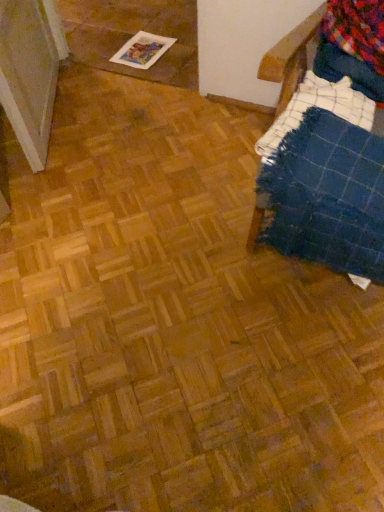
Question: Does multicolored flannel at upper right come in front of blue plaid blanket at right?

Choices:
 (A) no
 (B) yes

Answer: (A)

Question: Is multicolored flannel at upper right aimed at blue plaid blanket at right?

Choices:
 (A) no
 (B) yes

Answer: (B)

Question: Is multicolored flannel at upper right completely or partially outside of blue plaid blanket at right?

Choices:
 (A) no
 (B) yes

Answer: (A)

Question: From a real-world perspective, is multicolored flannel at upper right under blue plaid blanket at right?

Choices:
 (A) yes
 (B) no

Answer: (B)

Question: Is multicolored flannel at upper right oriented away from blue plaid blanket at right?

Choices:
 (A) yes
 (B) no

Answer: (A)

Question: In terms of height, does multicolored flannel at upper right look taller or shorter compared to printed paper magazine at upper left?

Choices:
 (A) short
 (B) tall

Answer: (B)

Question: In the image, is multicolored flannel at upper right positioned in front of or behind printed paper magazine at upper left?

Choices:
 (A) front
 (B) behind

Answer: (A)

Question: Is multicolored flannel at upper right to the left or to the right of printed paper magazine at upper left in the image?

Choices:
 (A) right
 (B) left

Answer: (A)

Question: Do you think multicolored flannel at upper right is within printed paper magazine at upper left, or outside of it?

Choices:
 (A) inside
 (B) outside

Answer: (B)

Question: From a real-world perspective, is printed paper magazine at upper left positioned above or below multicolored flannel at upper right?

Choices:
 (A) below
 (B) above

Answer: (A)

Question: Is printed paper magazine at upper left inside the boundaries of multicolored flannel at upper right, or outside?

Choices:
 (A) inside
 (B) outside

Answer: (B)

Question: From the image's perspective, is printed paper magazine at upper left above or below multicolored flannel at upper right?

Choices:
 (A) above
 (B) below

Answer: (A)

Question: Considering the positions of point (130, 40) and point (350, 36), is point (130, 40) closer or farther from the camera than point (350, 36)?

Choices:
 (A) farther
 (B) closer

Answer: (A)

Question: Considering the positions of multicolored flannel at upper right and blue plaid blanket at right in the image, is multicolored flannel at upper right wider or thinner than blue plaid blanket at right?

Choices:
 (A) thin
 (B) wide

Answer: (A)

Question: Is multicolored flannel at upper right bigger or smaller than blue plaid blanket at right?

Choices:
 (A) small
 (B) big

Answer: (A)